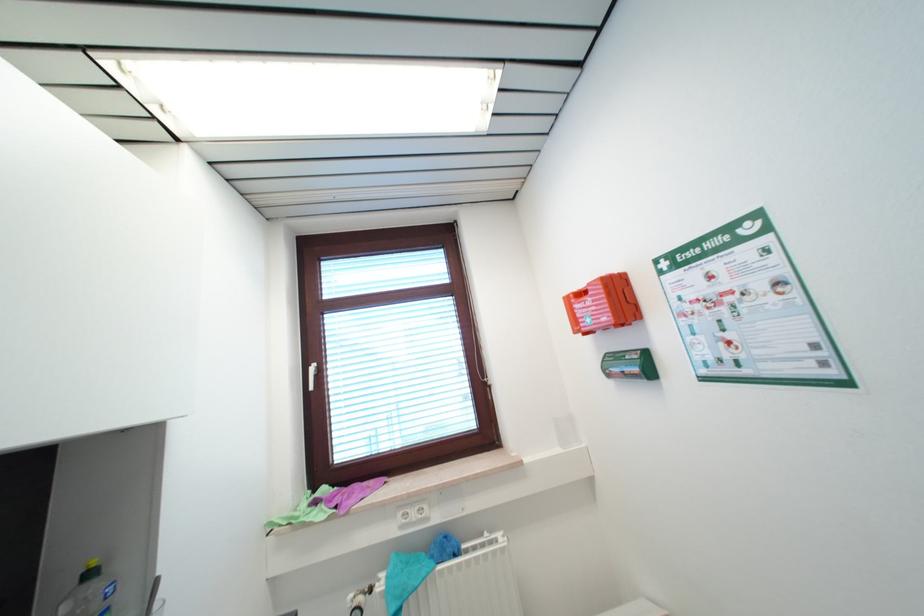
Locate an element on the screen. The image size is (924, 616). green cloth is located at coordinates (302, 511).